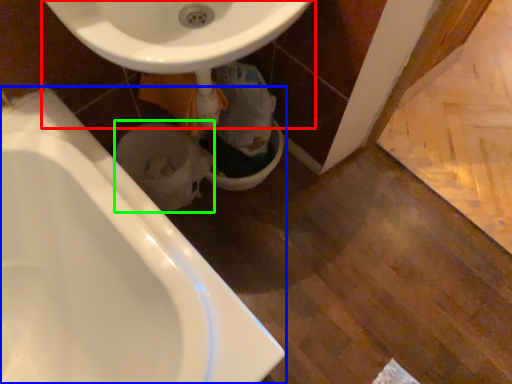
Question: Which object is positioned closest to sink (highlighted by a red box)? Select from bathtub (highlighted by a blue box) and toilet bowl (highlighted by a green box).

Choices:
 (A) bathtub
 (B) toilet bowl

Answer: (A)